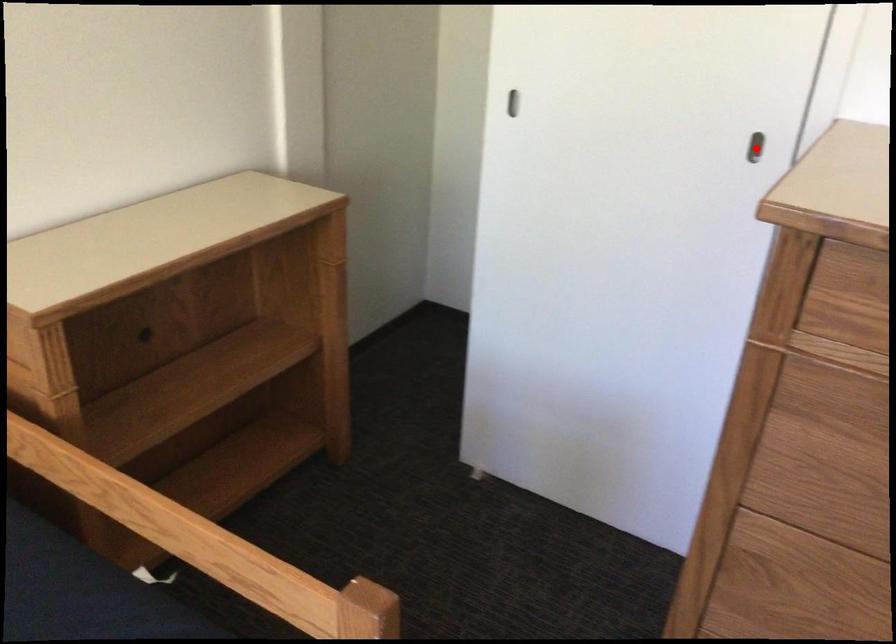
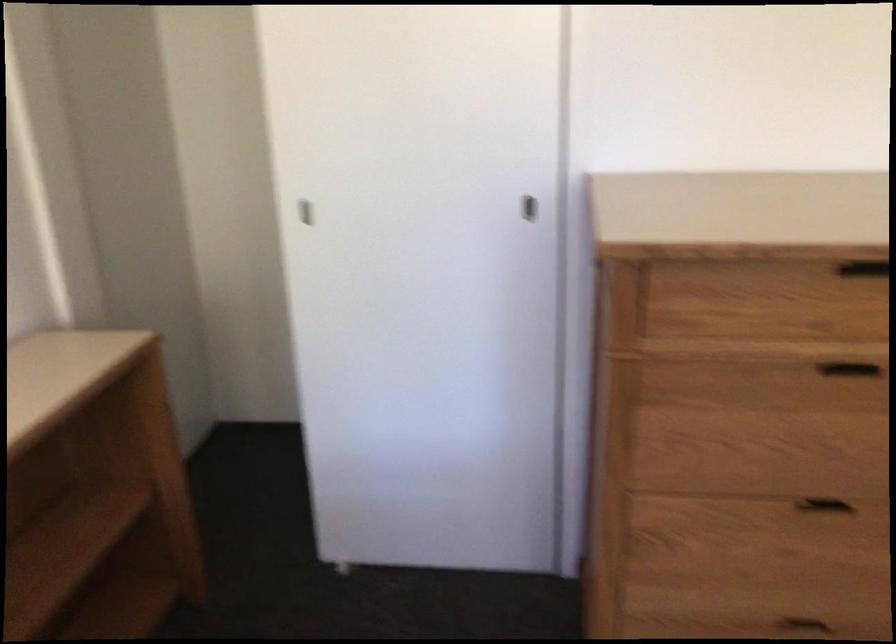
Question: A red point is marked in image1. In image2, is the corresponding 3D point closer to the camera or farther? Reply with the corresponding letter.

Choices:
 (A) The corresponding 3D point is closer.
 (B) The corresponding 3D point is farther.

Answer: (B)